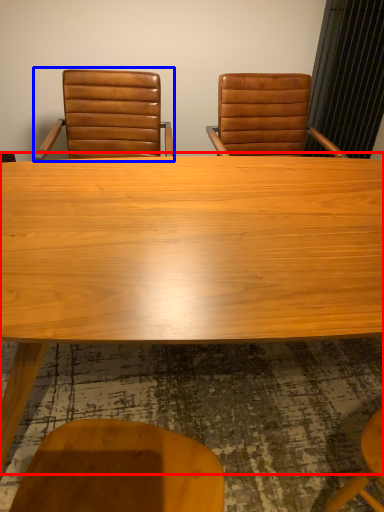
Question: Which of the following is the closest to the observer, table (highlighted by a red box) or chair (highlighted by a blue box)?

Choices:
 (A) table
 (B) chair

Answer: (A)